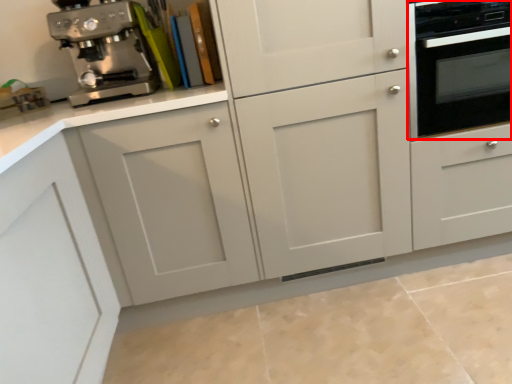
Question: From the image's perspective, where is home appliance (annotated by the red box) located in relation to coffee maker in the image?

Choices:
 (A) above
 (B) below

Answer: (B)